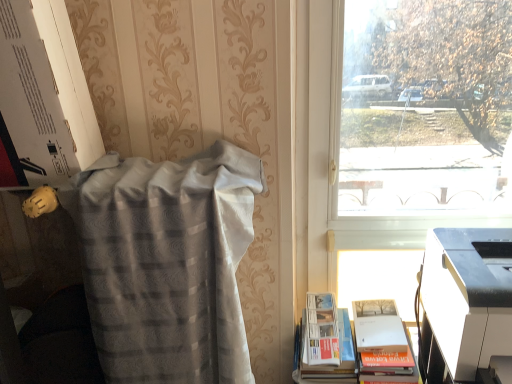
This screenshot has width=512, height=384. Identify the location of transparent glass window at upper right. (405, 123).

Based on the photo, measure the distance between white plastic printer at lower right and camera.

white plastic printer at lower right and camera are 32.20 inches apart from each other.

You are a GUI agent. You are given a task and a screenshot of the screen. Output one action in this format:
    pyautogui.click(x=<x>, y=<y>)
    Task: Click on the silvery textured blanket at left
    
    Given the screenshot: What is the action you would take?
    pyautogui.click(x=167, y=263)

Locate an element on the screen. Image resolution: width=512 pixels, height=384 pixels. transparent glass window at upper right is located at coordinates (405, 123).

Is white paperback book at lower right not near silvery textured blanket at left?

white paperback book at lower right is near silvery textured blanket at left, not far away.

Find the location of `book beneath the silvery textured blanket at left (from a real-world perspective)`. book beneath the silvery textured blanket at left (from a real-world perspective) is located at coordinates (383, 334).

Is white paperback book at lower right aimed at silvery textured blanket at left?

No, white paperback book at lower right is not oriented towards silvery textured blanket at left.

Is transparent glass window at upper right oriented towards silvery textured blanket at left?

No, transparent glass window at upper right is not oriented towards silvery textured blanket at left.

Which object is positioned more to the left, transparent glass window at upper right or silvery textured blanket at left?

silvery textured blanket at left.

Is silvery textured blanket at left completely or partially inside transparent glass window at upper right?

No, silvery textured blanket at left is located outside of transparent glass window at upper right.

Is the position of transparent glass window at upper right less distant than that of silvery textured blanket at left?

No, it is behind silvery textured blanket at left.

Which is closer, (451, 261) or (118, 354)?

The point (118, 354) is closer to the camera.

Which of these two, white plastic printer at lower right or silvery textured blanket at left, is bigger?

Bigger between the two is silvery textured blanket at left.

Can you confirm if white plastic printer at lower right is shorter than silvery textured blanket at left?

Correct, white plastic printer at lower right is not as tall as silvery textured blanket at left.

Can you confirm if white paperback book at lower right is positioned to the right of transparent glass window at upper right?

In fact, white paperback book at lower right is to the left of transparent glass window at upper right.

Are white paperback book at lower right and transparent glass window at upper right located far from each other?

Yes, white paperback book at lower right and transparent glass window at upper right are quite far apart.

Considering the sizes of objects white paperback book at lower right and transparent glass window at upper right in the image provided, who is thinner, white paperback book at lower right or transparent glass window at upper right?

transparent glass window at upper right.

What's the angular difference between white paperback book at lower right and transparent glass window at upper right's facing directions?

5.88 degrees.

Is white plastic printer at lower right touching white paperback book at lower right?

No.

Is white plastic printer at lower right not inside white paperback book at lower right?

Absolutely, white plastic printer at lower right is external to white paperback book at lower right.

How far apart are white plastic printer at lower right and white paperback book at lower right?

white plastic printer at lower right is 21.64 centimeters from white paperback book at lower right.

Can you see silvery textured blanket at left touching transparent glass window at upper right?

No, silvery textured blanket at left is not in contact with transparent glass window at upper right.

Does silvery textured blanket at left turn towards transparent glass window at upper right?

No, silvery textured blanket at left is not turned towards transparent glass window at upper right.

Which of these two, silvery textured blanket at left or transparent glass window at upper right, is wider?

silvery textured blanket at left.

Between silvery textured blanket at left and transparent glass window at upper right, which one has larger size?

With larger size is silvery textured blanket at left.

Which is in front, point (382, 349) or point (488, 362)?

Point (488, 362)

From a real-world perspective, which is physically below, white paperback book at lower right or white plastic printer at lower right?

white paperback book at lower right, from a real-world perspective.

Considering the sizes of objects white paperback book at lower right and white plastic printer at lower right in the image provided, who is wider, white paperback book at lower right or white plastic printer at lower right?

With larger width is white plastic printer at lower right.

From the image's perspective, is white paperback book at lower right positioned above or below white plastic printer at lower right?

From the image's perspective, white paperback book at lower right appears below white plastic printer at lower right.

You are a GUI agent. You are given a task and a screenshot of the screen. Output one action in this format:
    pyautogui.click(x=<x>, y=<y>)
    Task: Click on the book on the right of silvery textured blanket at left
    The image size is (512, 384).
    Given the screenshot: What is the action you would take?
    pyautogui.click(x=383, y=334)

Where is `blanket located underneath the transparent glass window at upper right (from a real-world perspective)`? Image resolution: width=512 pixels, height=384 pixels. blanket located underneath the transparent glass window at upper right (from a real-world perspective) is located at coordinates (167, 263).

Which object lies further to the anchor point white plastic printer at lower right, white paperback book at lower right or silvery textured blanket at left?

Among the two, silvery textured blanket at left is located further to white plastic printer at lower right.

Looking at this image, considering their positions, is silvery textured blanket at left positioned closer to white paperback book at lower right than transparent glass window at upper right?

silvery textured blanket at left is positioned closer to the anchor white paperback book at lower right.

Considering their positions, is transparent glass window at upper right positioned further to white paperback book at lower right than silvery textured blanket at left?

transparent glass window at upper right.

From the image, which object appears to be farther from silvery textured blanket at left, white paperback book at lower right or white plastic printer at lower right?

white plastic printer at lower right is further to silvery textured blanket at left.

Considering their positions, is transparent glass window at upper right positioned closer to white plastic printer at lower right than silvery textured blanket at left?

silvery textured blanket at left lies closer to white plastic printer at lower right than the other object.

Considering their positions, is transparent glass window at upper right positioned closer to white paperback book at lower right than white plastic printer at lower right?

white plastic printer at lower right is closer to white paperback book at lower right.

From the image, which object appears to be nearer to silvery textured blanket at left, white paperback book at lower right or transparent glass window at upper right?

white paperback book at lower right lies closer to silvery textured blanket at left than the other object.

Based on their spatial positions, is white paperback book at lower right or white plastic printer at lower right closer to transparent glass window at upper right?

Among the two, white plastic printer at lower right is located nearer to transparent glass window at upper right.

The width and height of the screenshot is (512, 384). What are the coordinates of `window located between silvery textured blanket at left and white plastic printer at lower right in the left-right direction` in the screenshot? It's located at (405, 123).

Locate an element on the screen. The image size is (512, 384). printer between transparent glass window at upper right and white paperback book at lower right in the vertical direction is located at coordinates (465, 301).

Locate an element on the screen. The image size is (512, 384). book situated between silvery textured blanket at left and transparent glass window at upper right from left to right is located at coordinates (383, 334).

At what (x,y) coordinates should I click in order to perform the action: click on book between silvery textured blanket at left and white plastic printer at lower right from left to right. Please return your answer as a coordinate pair (x, y). The image size is (512, 384). Looking at the image, I should click on (383, 334).